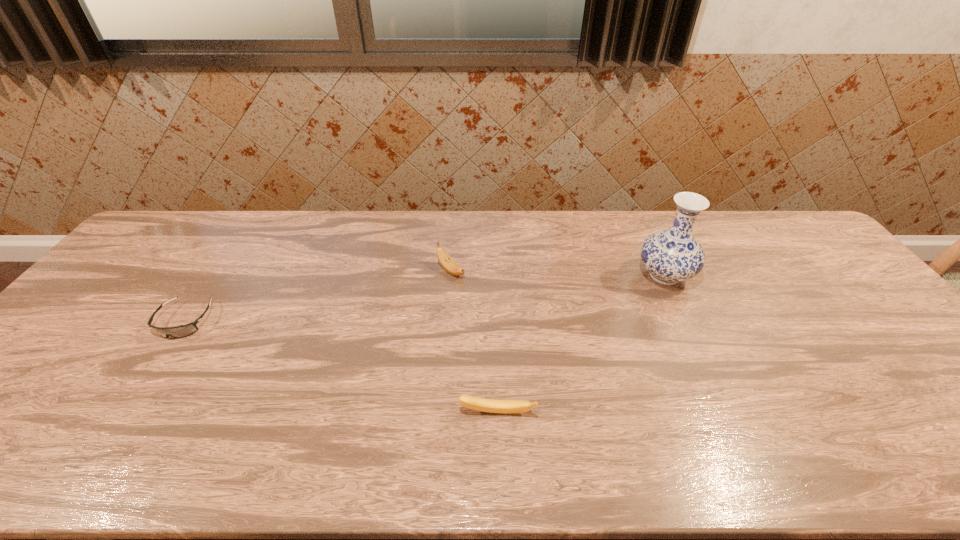
Image resolution: width=960 pixels, height=540 pixels. I want to click on vase, so click(x=673, y=255).

Image resolution: width=960 pixels, height=540 pixels. Identify the location of the tallest object. (673, 255).

The height and width of the screenshot is (540, 960). In order to click on the farther banana in this screenshot , I will do `click(446, 261)`.

Locate an element on the screen. Image resolution: width=960 pixels, height=540 pixels. the nearer banana is located at coordinates (475, 403).

At what (x,y) coordinates should I click in order to perform the action: click on the leftmost object. Please return your answer as a coordinate pair (x, y). The width and height of the screenshot is (960, 540). Looking at the image, I should click on (181, 331).

Image resolution: width=960 pixels, height=540 pixels. I want to click on goggles, so click(x=181, y=331).

Identify the location of free space located on the right of the vase. (815, 276).

Find the location of `blank space located on the right of the farther banana`. blank space located on the right of the farther banana is located at coordinates (501, 271).

The width and height of the screenshot is (960, 540). Identify the location of free space located 0.070m at the stem of the nearest object. (498, 450).

You are a GUI agent. You are given a task and a screenshot of the screen. Output one action in this format:
    pyautogui.click(x=<x>, y=<y>)
    Task: Click on the vacant space positioned 0.240m on the lenses of the leftmost object
    The image size is (960, 540).
    Given the screenshot: What is the action you would take?
    pyautogui.click(x=115, y=426)